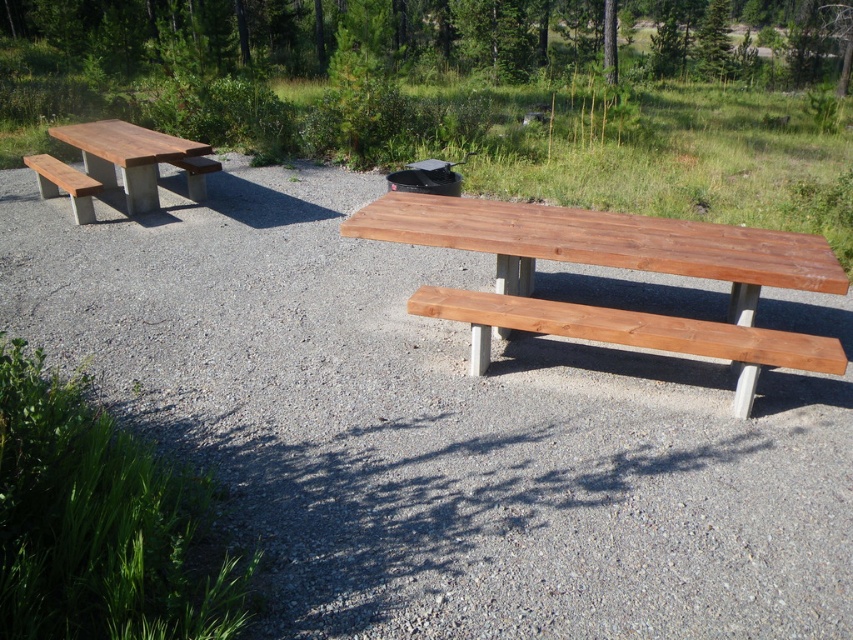
Which of these two, matte wood picnic table at left or wooden bench at left, stands taller?

matte wood picnic table at left

Describe the element at coordinates (131, 156) in the screenshot. I see `matte wood picnic table at left` at that location.

Is point (218, 164) in front of point (212, 163)?

Yes, it is in front of point (212, 163).

The width and height of the screenshot is (853, 640). Identify the location of matte wood picnic table at left. (131, 156).

Between matte wood picnic table at left and matte wood bench at left, which one is positioned lower?

matte wood bench at left

Image resolution: width=853 pixels, height=640 pixels. I want to click on matte wood picnic table at left, so click(131, 156).

You are a GUI agent. You are given a task and a screenshot of the screen. Output one action in this format:
    pyautogui.click(x=<x>, y=<y>)
    Task: Click on the matte wood picnic table at left
    Image resolution: width=853 pixels, height=640 pixels.
    Given the screenshot: What is the action you would take?
    pyautogui.click(x=131, y=156)

Is shiny brown wood picnic table at center to the left of matte wood bench at left from the viewer's perspective?

Incorrect, shiny brown wood picnic table at center is not on the left side of matte wood bench at left.

Is shiny brown wood picnic table at center thinner than matte wood bench at left?

Incorrect, shiny brown wood picnic table at center's width is not less than matte wood bench at left's.

This screenshot has width=853, height=640. What do you see at coordinates (618, 268) in the screenshot?
I see `shiny brown wood picnic table at center` at bounding box center [618, 268].

Where is `shiny brown wood picnic table at center`? Image resolution: width=853 pixels, height=640 pixels. shiny brown wood picnic table at center is located at coordinates (618, 268).